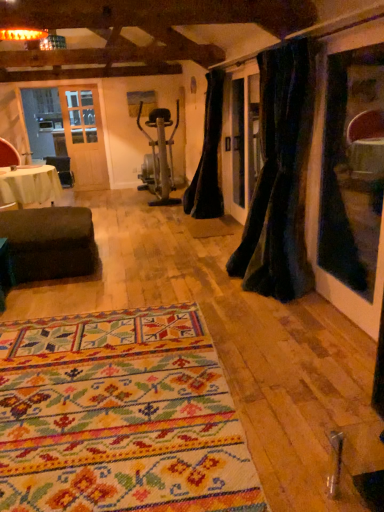
This screenshot has width=384, height=512. Describe the element at coordinates (29, 185) in the screenshot. I see `white fabric-covered table at left` at that location.

Based on the photo, in order to face white fabric-covered table at left, should I rotate leftwards or rightwards?

You should rotate left by 21.381 degrees.

This screenshot has height=512, width=384. I want to click on black velvet curtain at center, the first curtain positioned from the left, so click(x=208, y=156).

What do you see at coordinates (120, 417) in the screenshot? The height and width of the screenshot is (512, 384). I see `multicolored woven rug at center` at bounding box center [120, 417].

Describe the element at coordinates (280, 177) in the screenshot. I see `velvet dark green curtain at right, the second curtain positioned from the left` at that location.

I want to click on dark brown fabric ottoman at lower left, so click(50, 242).

In order to click on white fabric-covered table at left in this screenshot , I will do `click(29, 185)`.

Which is nearer, (228, 262) or (8, 227)?

Point (228, 262) is positioned closer to the camera compared to point (8, 227).

Image resolution: width=384 pixels, height=512 pixels. In order to click on studio couch behind the velvet dark green curtain at right, the 2th curtain positioned from the back in this screenshot , I will do `click(50, 242)`.

Is velvet dark green curtain at right, which appears as the 1th curtain when viewed from the right, turned away from dark brown fabric ottoman at lower left?

No, dark brown fabric ottoman at lower left is not at the back of velvet dark green curtain at right, which appears as the 1th curtain when viewed from the right.

Which object is positioned more to the right, velvet dark green curtain at right, the 2th curtain positioned from the back, or dark brown fabric ottoman at lower left?

From the viewer's perspective, velvet dark green curtain at right, the 2th curtain positioned from the back, appears more on the right side.

In the image, is black velvet curtain at center, arranged as the 1th curtain when viewed from the back, on the left side or the right side of white fabric-covered table at left?

black velvet curtain at center, arranged as the 1th curtain when viewed from the back, is to the right of white fabric-covered table at left.

Does black velvet curtain at center, marked as the 2th curtain in a front-to-back arrangement, have a greater height compared to white fabric-covered table at left?

Indeed, black velvet curtain at center, marked as the 2th curtain in a front-to-back arrangement, has a greater height compared to white fabric-covered table at left.

From a real-world perspective, which is physically above, black velvet curtain at center, the first curtain positioned from the left, or white fabric-covered table at left?

black velvet curtain at center, the first curtain positioned from the left.

Considering the positions of objects multicolored woven rug at center and black velvet curtain at center, acting as the 2th curtain starting from the right, in the image provided, who is more to the right, multicolored woven rug at center or black velvet curtain at center, acting as the 2th curtain starting from the right,?

black velvet curtain at center, acting as the 2th curtain starting from the right, is more to the right.

Is multicolored woven rug at center oriented towards black velvet curtain at center, arranged as the 1th curtain when viewed from the back?

No, multicolored woven rug at center is not oriented towards black velvet curtain at center, arranged as the 1th curtain when viewed from the back.

Which object is thinner, multicolored woven rug at center or black velvet curtain at center, arranged as the 1th curtain when viewed from the back?

black velvet curtain at center, arranged as the 1th curtain when viewed from the back, is thinner.

This screenshot has height=512, width=384. What are the coordinates of `armchair located above the velvet dark green curtain at right, the second curtain positioned from the left (from the image's perspective)` in the screenshot? It's located at (8, 154).

What's the angular difference between velvet dark green curtain at right, arranged as the first curtain when viewed from the front, and red leather armchair at left's facing directions?

They differ by 116 degrees in their facing directions.

How much distance is there between velvet dark green curtain at right, which appears as the 1th curtain when viewed from the right, and red leather armchair at left?

velvet dark green curtain at right, which appears as the 1th curtain when viewed from the right, and red leather armchair at left are 15.28 feet apart.

From a real-world perspective, is velvet dark green curtain at right, which appears as the 1th curtain when viewed from the right, beneath red leather armchair at left?

No.

Considering the relative sizes of multicolored woven rug at center and dark brown fabric ottoman at lower left in the image provided, is multicolored woven rug at center bigger than dark brown fabric ottoman at lower left?

No.

Is multicolored woven rug at center positioned far away from dark brown fabric ottoman at lower left?

multicolored woven rug at center is positioned a significant distance from dark brown fabric ottoman at lower left.

Considering the relative positions of multicolored woven rug at center and dark brown fabric ottoman at lower left in the image provided, is multicolored woven rug at center to the right of dark brown fabric ottoman at lower left from the viewer's perspective?

Correct, you'll find multicolored woven rug at center to the right of dark brown fabric ottoman at lower left.

From the image's perspective, is white fabric-covered table at left beneath multicolored woven rug at center?

Actually, white fabric-covered table at left appears above multicolored woven rug at center in the image.

From the picture: Does white fabric-covered table at left turn towards multicolored woven rug at center?

No, white fabric-covered table at left is not aimed at multicolored woven rug at center.

From a real-world perspective, relative to multicolored woven rug at center, is white fabric-covered table at left vertically above or below?

From a real-world perspective, white fabric-covered table at left is physically above multicolored woven rug at center.

Between dark brown fabric ottoman at lower left and velvet dark green curtain at right, the 2th curtain positioned from the back, which one has larger size?

dark brown fabric ottoman at lower left.

Is dark brown fabric ottoman at lower left at the left side of velvet dark green curtain at right, which appears as the 1th curtain when viewed from the right?

Yes.

Does dark brown fabric ottoman at lower left have a greater width compared to velvet dark green curtain at right, the second curtain positioned from the left?

Correct, the width of dark brown fabric ottoman at lower left exceeds that of velvet dark green curtain at right, the second curtain positioned from the left.

Is dark brown fabric ottoman at lower left oriented away from velvet dark green curtain at right, arranged as the first curtain when viewed from the front?

No, dark brown fabric ottoman at lower left is not facing the opposite direction of velvet dark green curtain at right, arranged as the first curtain when viewed from the front.

Identify the location of studio couch located behind the velvet dark green curtain at right, the second curtain positioned from the left. (50, 242).

In the image, there is a black velvet curtain at center, acting as the 2th curtain starting from the right. Where is `table below it (from the image's perspective)`? The width and height of the screenshot is (384, 512). table below it (from the image's perspective) is located at coordinates (29, 185).

Based on their spatial positions, is multicolored woven rug at center or dark brown fabric ottoman at lower left closer to black velvet curtain at center, arranged as the 1th curtain when viewed from the back?

Among the two, dark brown fabric ottoman at lower left is located nearer to black velvet curtain at center, arranged as the 1th curtain when viewed from the back.

Estimate the real-world distances between objects in this image. Which object is further from red leather armchair at left, velvet dark green curtain at right, the second curtain positioned from the left, or multicolored woven rug at center?

multicolored woven rug at center is positioned further to the anchor red leather armchair at left.

Which object lies nearer to the anchor point white fabric-covered table at left, black velvet curtain at center, acting as the 2th curtain starting from the right, or dark brown fabric ottoman at lower left?

dark brown fabric ottoman at lower left.

In the scene shown: Based on their spatial positions, is red leather armchair at left or black velvet curtain at center, the first curtain positioned from the left, closer to dark brown fabric ottoman at lower left?

black velvet curtain at center, the first curtain positioned from the left.

Estimate the real-world distances between objects in this image. Which object is further from white fabric-covered table at left, red leather armchair at left or dark brown fabric ottoman at lower left?

dark brown fabric ottoman at lower left lies further to white fabric-covered table at left than the other object.

Looking at the image, which one is located further to velvet dark green curtain at right, the second curtain positioned from the left, red leather armchair at left or black velvet curtain at center, arranged as the 1th curtain when viewed from the back?

The object further to velvet dark green curtain at right, the second curtain positioned from the left, is red leather armchair at left.

Considering their positions, is red leather armchair at left positioned closer to multicolored woven rug at center than velvet dark green curtain at right, the second curtain positioned from the left?

velvet dark green curtain at right, the second curtain positioned from the left, is positioned closer to the anchor multicolored woven rug at center.

Considering their positions, is velvet dark green curtain at right, the 2th curtain positioned from the back, positioned closer to white fabric-covered table at left than multicolored woven rug at center?

velvet dark green curtain at right, the 2th curtain positioned from the back, lies closer to white fabric-covered table at left than the other object.

Where is `studio couch between velvet dark green curtain at right, the second curtain positioned from the left, and red leather armchair at left, along the z-axis`? Image resolution: width=384 pixels, height=512 pixels. studio couch between velvet dark green curtain at right, the second curtain positioned from the left, and red leather armchair at left, along the z-axis is located at coordinates (50, 242).

The width and height of the screenshot is (384, 512). What are the coordinates of `studio couch positioned between multicolored woven rug at center and black velvet curtain at center, arranged as the 1th curtain when viewed from the back, from near to far` in the screenshot? It's located at (50, 242).

The height and width of the screenshot is (512, 384). I want to click on table between multicolored woven rug at center and black velvet curtain at center, arranged as the 1th curtain when viewed from the back, in the front-back direction, so click(29, 185).

This screenshot has width=384, height=512. I want to click on table between velvet dark green curtain at right, the 2th curtain positioned from the back, and red leather armchair at left, along the z-axis, so click(29, 185).